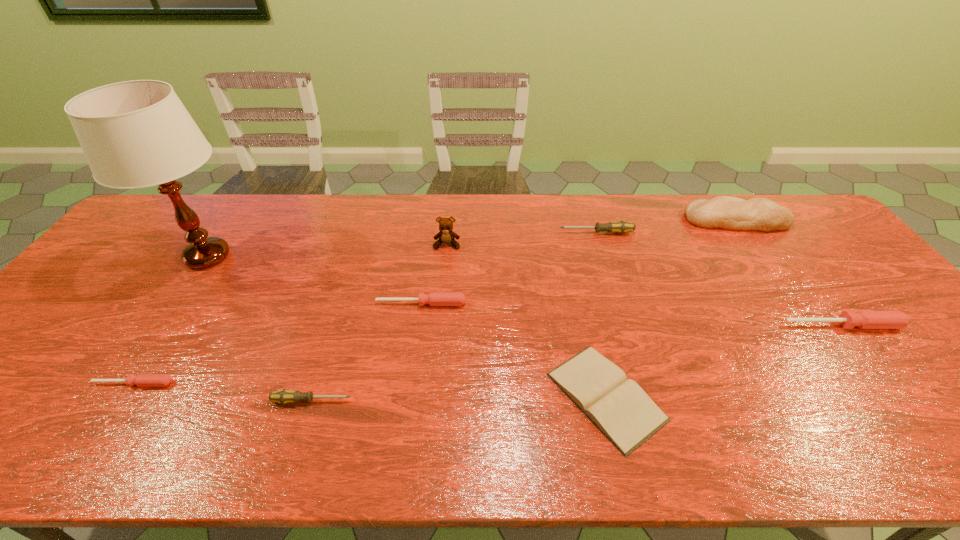
Image resolution: width=960 pixels, height=540 pixels. In order to click on the second biggest red screwdriver in this screenshot , I will do `click(434, 298)`.

In order to click on the left gray screwdriver in this screenshot , I will do `click(284, 396)`.

This screenshot has width=960, height=540. What are the coordinates of `the fourth screwdriver from right to left` in the screenshot? It's located at pos(284,396).

The image size is (960, 540). In order to click on the leftmost screwdriver in this screenshot , I will do `click(143, 380)`.

Where is `the fourth farthest screwdriver`? The width and height of the screenshot is (960, 540). the fourth farthest screwdriver is located at coordinates (143, 380).

The width and height of the screenshot is (960, 540). What are the coordinates of `Bible` in the screenshot? It's located at (617, 406).

Find the location of a particular element. The height and width of the screenshot is (540, 960). free space located 0.310m on the front of the brown table lamp is located at coordinates (122, 384).

What are the coordinates of `vacant space situated on the front-facing side of the brown teddy bear` in the screenshot? It's located at (439, 342).

Find the location of a particular element. blank space located 0.400m on the front of the seventh shortest object is located at coordinates (813, 332).

Identify the location of vacant space located 0.320m at the tip of the right gray screwdriver. This screenshot has height=540, width=960. (459, 233).